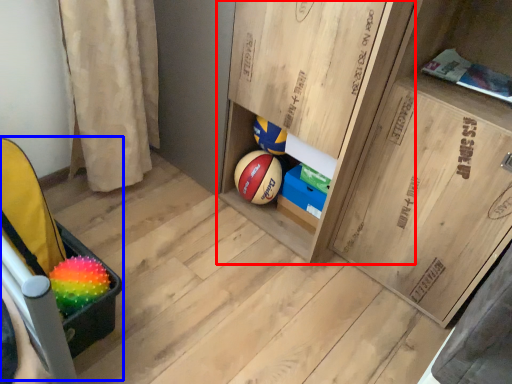
Question: Among these objects, which one is nearest to the camera, cabinetry (highlighted by a red box) or baby carriage (highlighted by a blue box)?

Choices:
 (A) cabinetry
 (B) baby carriage

Answer: (A)